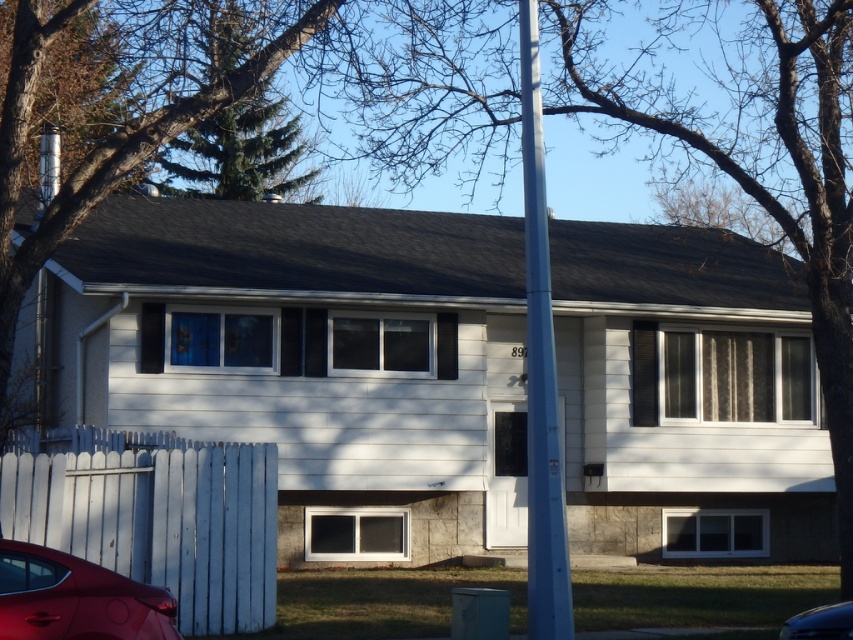
Who is lower down, blue metallic pole at center or metallic silver car at lower right?

metallic silver car at lower right is below.

Does blue metallic pole at center lie in front of metallic silver car at lower right?

No, it is not.

Where is `blue metallic pole at center`? This screenshot has height=640, width=853. blue metallic pole at center is located at coordinates (540, 372).

Who is positioned more to the left, shiny red sedan at lower left or metallic silver car at lower right?

Positioned to the left is shiny red sedan at lower left.

Can you confirm if shiny red sedan at lower left is positioned to the left of metallic silver car at lower right?

Yes, shiny red sedan at lower left is to the left of metallic silver car at lower right.

Which is behind, point (107, 577) or point (849, 637)?

Point (107, 577)

Where is `shiny red sedan at lower left`? This screenshot has height=640, width=853. shiny red sedan at lower left is located at coordinates (74, 598).

Can you confirm if white wooden fence at lower left is positioned to the left of shiny red sedan at lower left?

Yes, white wooden fence at lower left is to the left of shiny red sedan at lower left.

Does white wooden fence at lower left have a greater width compared to shiny red sedan at lower left?

Correct, the width of white wooden fence at lower left exceeds that of shiny red sedan at lower left.

Is point (137, 502) more distant than point (102, 637)?

Yes, it is behind point (102, 637).

I want to click on white wooden fence at lower left, so (x=155, y=516).